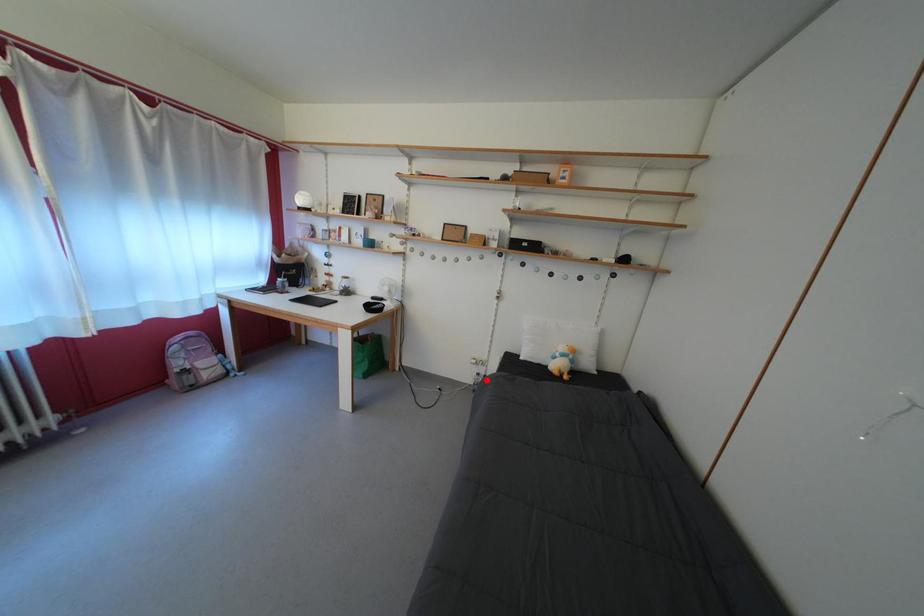
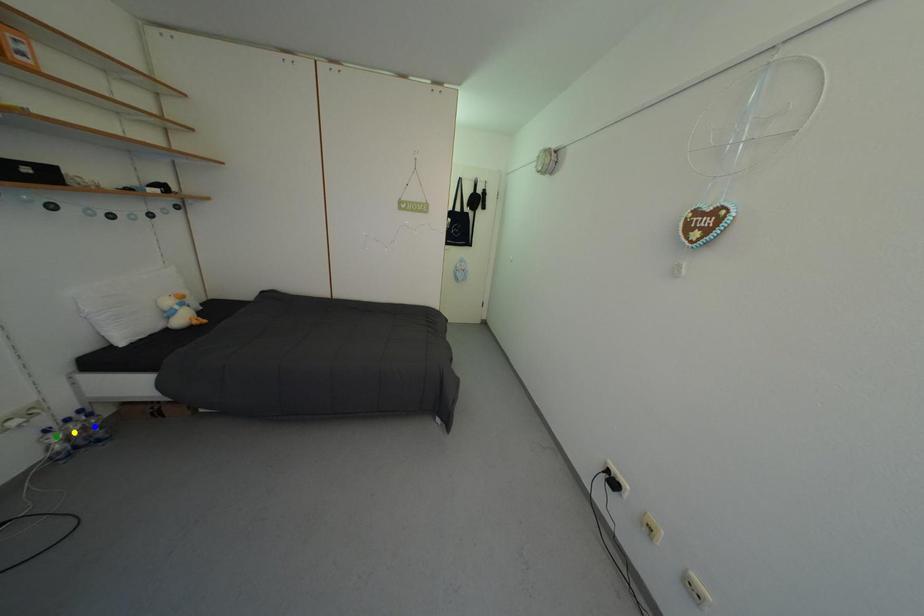
Question: I am providing you with two images of the same scene from different viewpoints. A red point is marked on the first image. You are given multiple points on the second image. Which mark in image 2 goes with the point in image 1?

Choices:
 (A) blue point
 (B) yellow point
 (C) green point

Answer: (C)